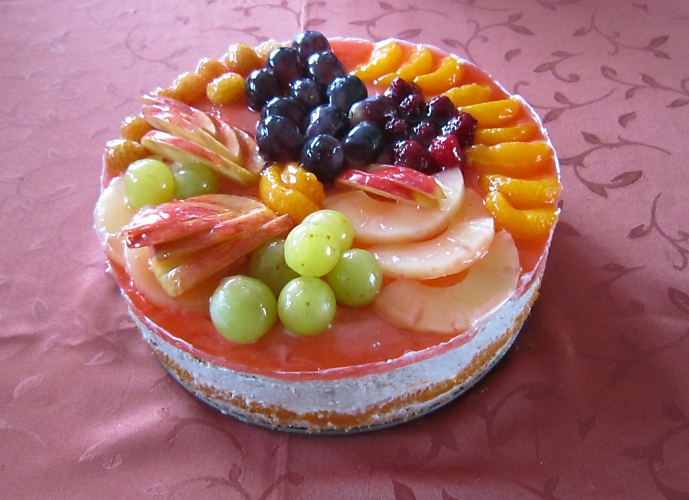
Locate an element on the screen. Image resolution: width=689 pixels, height=500 pixels. tablecloth is located at coordinates (650, 168).